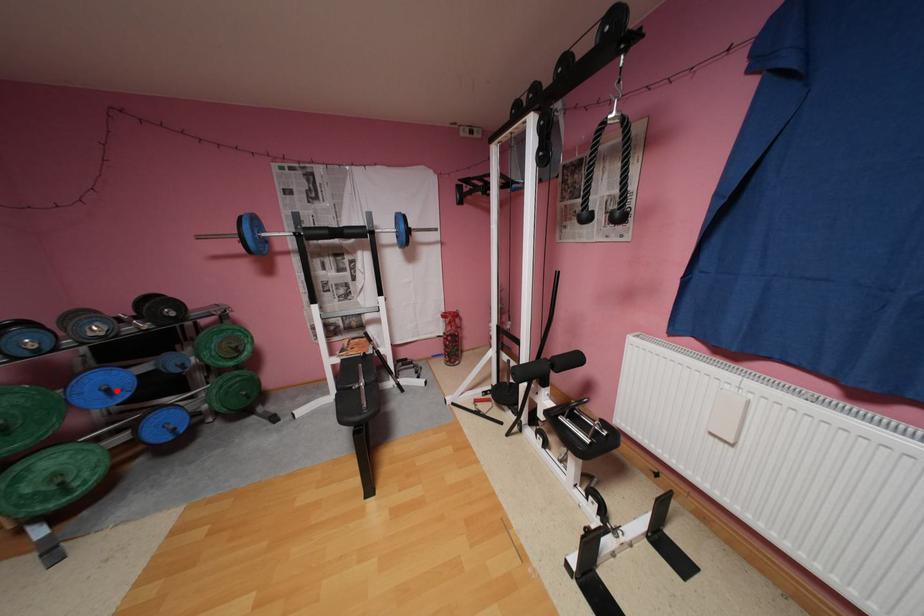
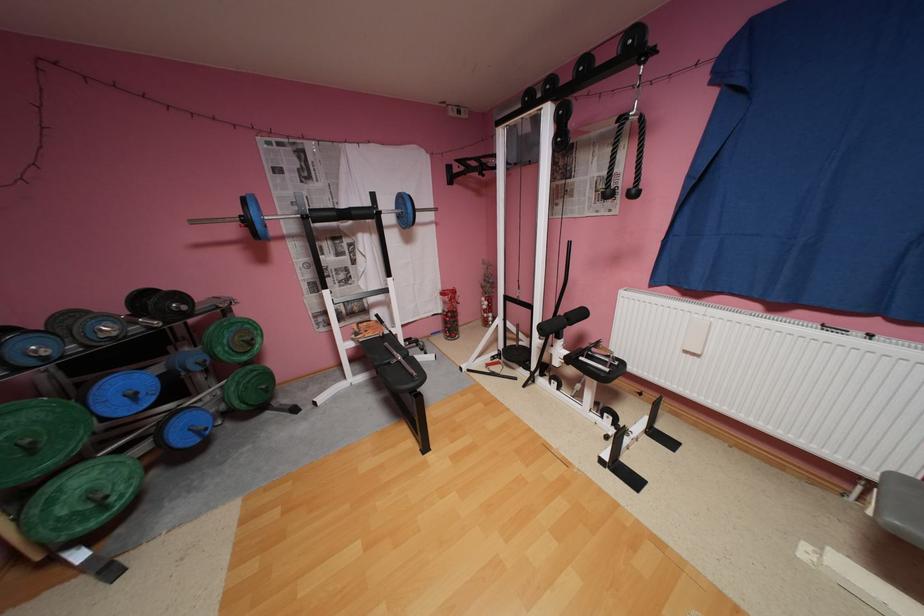
Find the pixel in the second image that matches the highlighted location in the first image.

(142, 395)